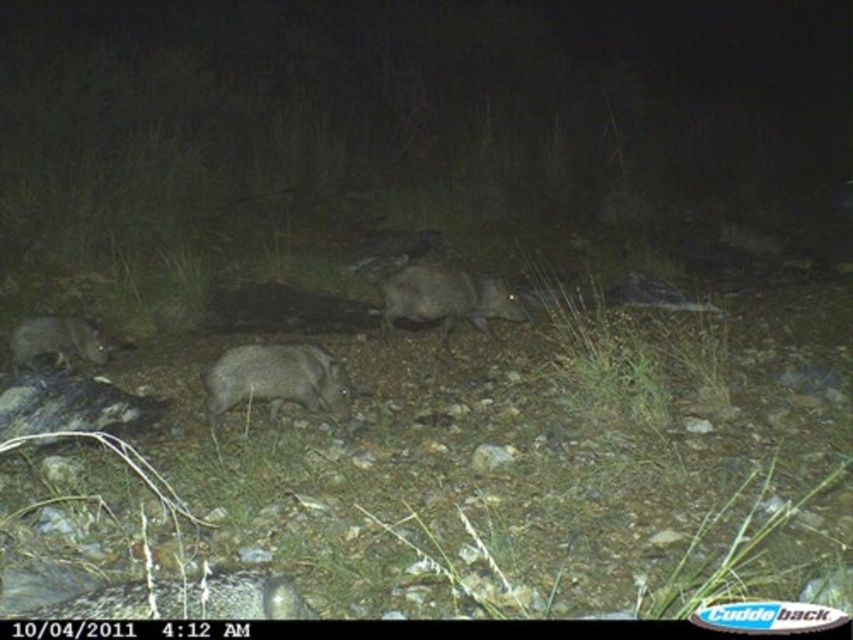
Question: Does gray fur animal at center have a smaller size compared to gray matte boar at center?

Choices:
 (A) yes
 (B) no

Answer: (A)

Question: Which object is the closest to the gray fur animal at lower left?

Choices:
 (A) gray fur animal at center
 (B) gray furry boar at center

Answer: (B)

Question: Is gray matte boar at center below gray fur animal at lower left?

Choices:
 (A) no
 (B) yes

Answer: (A)

Question: Which object appears farthest from the camera in this image?

Choices:
 (A) gray furry boar at center
 (B) gray fur animal at center
 (C) gray matte boar at center

Answer: (C)

Question: Which point is farther to the camera?

Choices:
 (A) (236, 604)
 (B) (254, 384)
 (C) (67, 324)

Answer: (C)

Question: Does gray fur animal at center appear over gray fur animal at lower left?

Choices:
 (A) yes
 (B) no

Answer: (B)